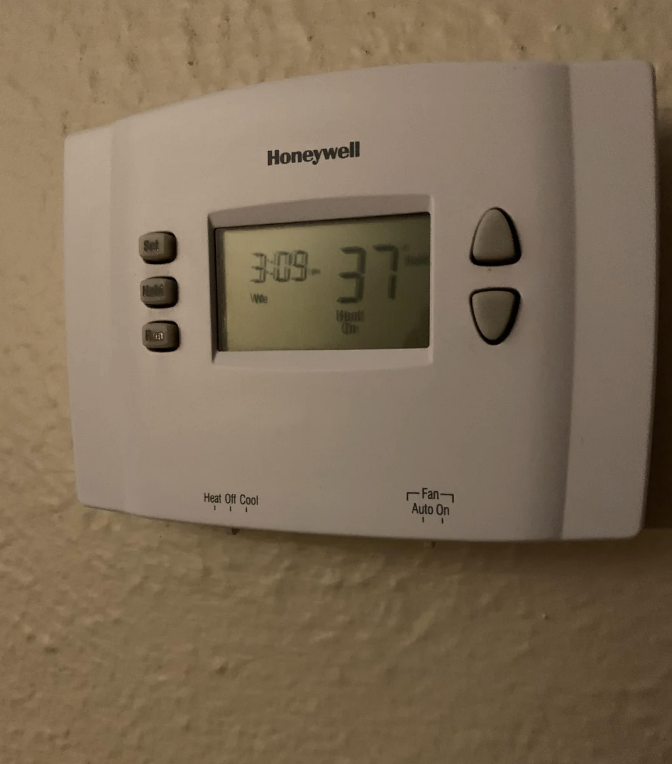
Locate an element on the screen. push button is located at coordinates (158, 337).